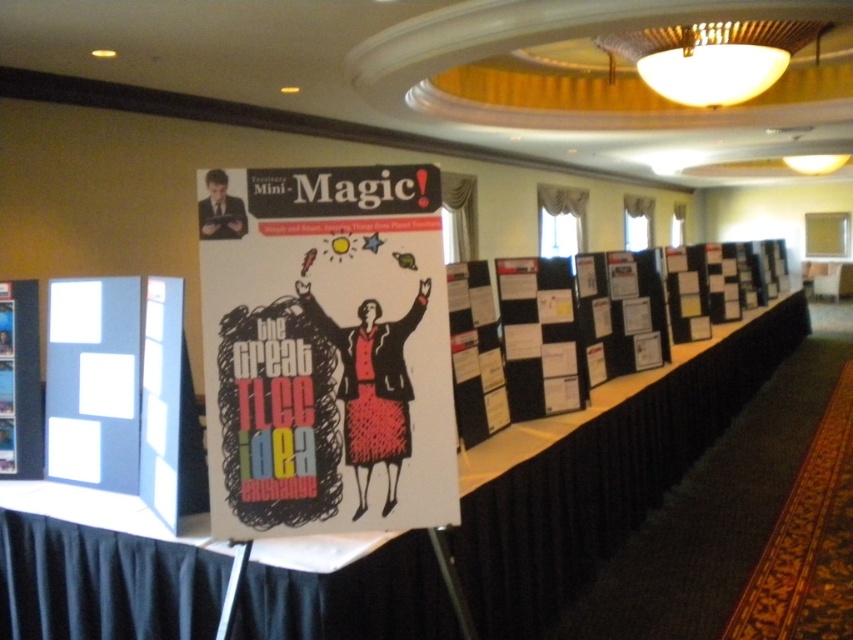
You are setting up for an event and need to place a 3.5 feet wide table between the matte black poster at center and the white cardboard poster at left. Is there enough space between them to accommodate the table?

The matte black poster at center and white cardboard poster at left are 5.31 feet apart from each other. Since the table is 3.5 feet wide, there is enough space between them to place the table as the distance between the posters is greater than the table width.

You are standing in the conference room and need to place a new poster exactly at the center of the room. The room has a coordinate system where the bottom left corner is the origin. The existing matte black poster at center is at point (x=325, y=349). Can you determine if the new poster should be placed at the same coordinates as the matte black poster at center?

The matte black poster at center is already at point (x=325, y=349), so placing the new poster at the same coordinates would mean it occupies the same position. Since the question specifies placing it exactly at the center, and the existing poster is already there, you should confirm whether overlapping is acceptable. If not, adjust the coordinates slightly.

You are organizing a presentation and need to place both the matte black poster at center and the white cardboard poster at left on a wall. The wall has limited space, and you want to ensure that the larger poster is placed first. Which poster should you hang first?

The matte black poster at center is larger than the white cardboard poster at left, so you should hang the matte black poster at center first to ensure it fits properly.